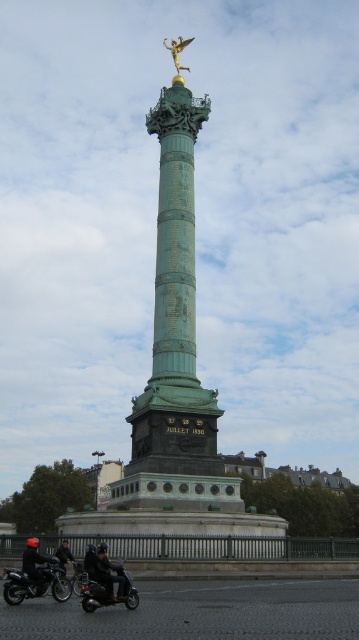
You are a photographer planning to take a wide shot of the Colonne de Juillet. You need to position your camera so that both the shiny black scooter at lower left and the black leather jacket at lower left are fully visible in the frame. Given their relative sizes, which object should you ensure is closer to the camera to avoid cropping either one?

Since the shiny black scooter at lower left is narrower than the black leather jacket at lower left, you should position the shiny black scooter at lower left closer to the camera. This way, its smaller width will fit within the frame without overlapping the jacket, ensuring both are fully visible.

What is located at the point with coordinates (x=178, y=51) in the image?

The gold metallic angel at upper center is located at point (x=178, y=51).

You are a tourist standing at the base of the Colonne de Juillet in Paris. You notice two points marked on the monument. The first point is located at coordinates point (178, 56) and the second at point (63, 541). From your vantage point, which point is farther away from you?

Point (178, 56) is behind point (63, 541), so it is farther away from you.